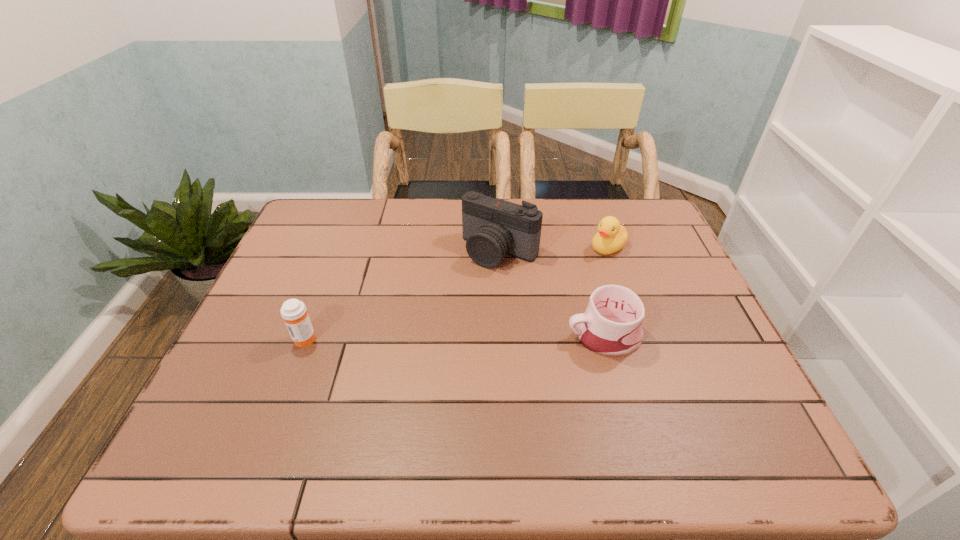
You are a GUI agent. You are given a task and a screenshot of the screen. Output one action in this format:
    pyautogui.click(x=<x>, y=<y>)
    Task: Click on the free space between the third object from right to left and the duckling
    The image size is (960, 540).
    Given the screenshot: What is the action you would take?
    pyautogui.click(x=554, y=249)

What are the coordinates of `vacant space that is in between the third object from right to left and the leftmost object` in the screenshot? It's located at (402, 295).

Where is `empty location between the second object from left to right and the mug`? This screenshot has height=540, width=960. empty location between the second object from left to right and the mug is located at coordinates (552, 293).

This screenshot has height=540, width=960. I want to click on the third closest object to the camera, so click(x=293, y=311).

In order to click on object that can be found as the third closest to the duckling in this screenshot , I will do `click(293, 311)`.

Locate an element on the screen. The image size is (960, 540). vacant point that satisfies the following two spatial constraints: 1. on the back side of the mug; 2. on the side with the handle of the medicine is located at coordinates (306, 335).

This screenshot has height=540, width=960. In order to click on free region that satisfies the following two spatial constraints: 1. on the back side of the duckling; 2. on the right side of the medicine in this screenshot , I will do `click(340, 247)`.